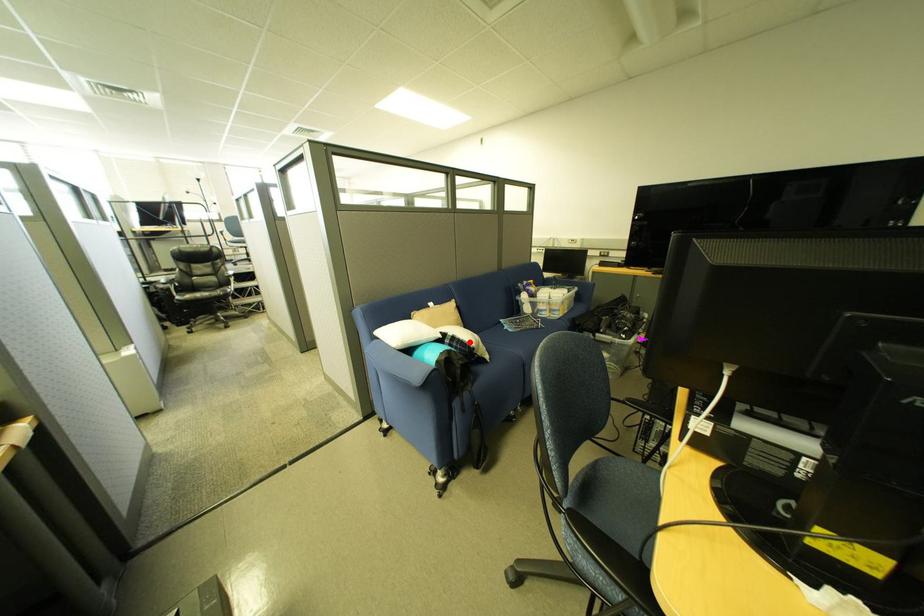
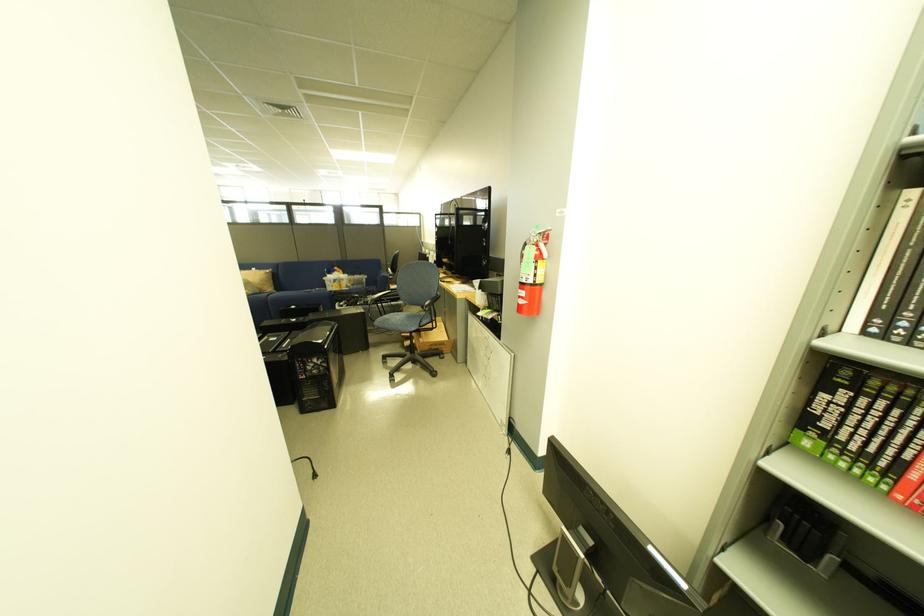
Question: I am providing you with two images of the same scene from different viewpoints. A red point is marked on the first image. At the location where the point appears in image 1, is it still visible in image 2?

Choices:
 (A) Yes
 (B) No

Answer: (B)